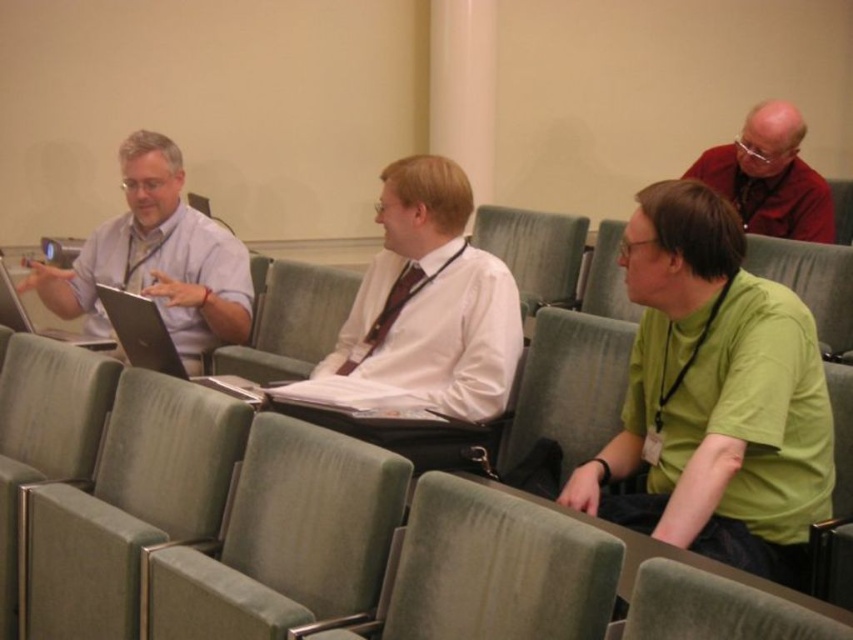
Which of these two, green matte shirt at center or velvet green chair at center, stands shorter?

With less height is velvet green chair at center.

Who is positioned more to the right, green matte shirt at center or velvet green chair at center?

From the viewer's perspective, green matte shirt at center appears more on the right side.

This screenshot has height=640, width=853. In order to click on green matte shirt at center in this screenshot , I will do `click(714, 396)`.

In the scene shown: Is matte gray shirt at left closer to the viewer compared to silver metallic laptop at left?

Yes.

This screenshot has height=640, width=853. What do you see at coordinates (157, 259) in the screenshot?
I see `matte gray shirt at left` at bounding box center [157, 259].

Is point (91, 256) positioned in front of point (0, 282)?

No, it is not.

This screenshot has width=853, height=640. Identify the location of matte gray shirt at left. (157, 259).

Does point (166, 593) come in front of point (144, 358)?

Yes, it is.

Does velvet green chair at center have a greater height compared to matte black laptop at center left?

Yes.

The image size is (853, 640). What do you see at coordinates (285, 540) in the screenshot? I see `velvet green chair at center` at bounding box center [285, 540].

You are a GUI agent. You are given a task and a screenshot of the screen. Output one action in this format:
    pyautogui.click(x=<x>, y=<y>)
    Task: Click on the velvet green chair at center
    The height and width of the screenshot is (640, 853).
    Given the screenshot: What is the action you would take?
    pyautogui.click(x=285, y=540)